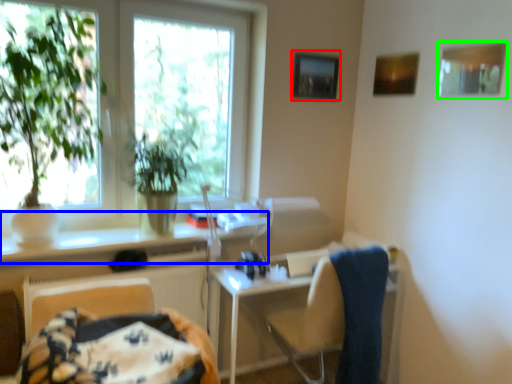
Question: Estimate the real-world distances between objects in this image. Which object is closer to picture frame (highlighted by a red box), counter top (highlighted by a blue box) or picture frame (highlighted by a green box)?

Choices:
 (A) counter top
 (B) picture frame

Answer: (B)